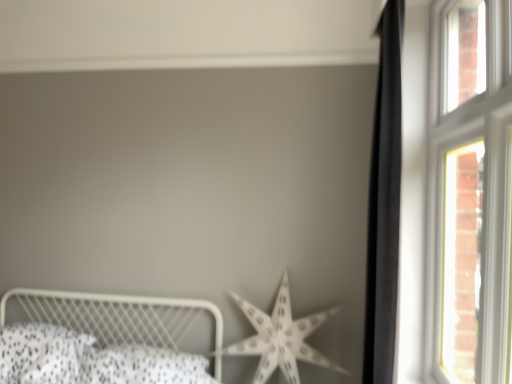
You are a GUI agent. You are given a task and a screenshot of the screen. Output one action in this format:
    pyautogui.click(x=<x>, y=<y>)
    Task: Click on the white wooden window at right
    The image size is (512, 384).
    Given the screenshot: What is the action you would take?
    pyautogui.click(x=469, y=193)

Locate an element on the screen. The height and width of the screenshot is (384, 512). black matte curtain at right is located at coordinates (384, 203).

Locate an element on the screen. white paper star at center is located at coordinates (280, 337).

Where is `white wooden window at right`? white wooden window at right is located at coordinates (469, 193).

At what (x,y) coordinates should I click in order to perform the action: click on curtain below the white wooden window at right (from a real-world perspective). Please return your answer as a coordinate pair (x, y). The image size is (512, 384). Looking at the image, I should click on (384, 203).

Can you tell me how much black matte curtain at right and white wooden window at right differ in facing direction?

There is a 2.27-degree angle between the facing directions of black matte curtain at right and white wooden window at right.

Considering the relative sizes of black matte curtain at right and white wooden window at right in the image provided, is black matte curtain at right smaller than white wooden window at right?

Correct, black matte curtain at right occupies less space than white wooden window at right.

From the image's perspective, is black matte curtain at right located above or below white wooden window at right?

black matte curtain at right is situated lower than white wooden window at right in the image.

Is black matte curtain at right not inside white paper star at center?

Yes, black matte curtain at right is located beyond the bounds of white paper star at center.

Does black matte curtain at right have a greater width compared to white paper star at center?

No, black matte curtain at right is not wider than white paper star at center.

Considering the relative sizes of black matte curtain at right and white paper star at center in the image provided, is black matte curtain at right bigger than white paper star at center?

No, black matte curtain at right is not bigger than white paper star at center.

Is black matte curtain at right aimed at white paper star at center?

No, black matte curtain at right is not turned towards white paper star at center.

From the image's perspective, who appears lower, black matte curtain at right or white metal bed at lower left?

white metal bed at lower left appears lower in the image.

From the picture: Which object is positioned more to the left, black matte curtain at right or white metal bed at lower left?

white metal bed at lower left.

Is black matte curtain at right oriented towards white metal bed at lower left?

Yes, black matte curtain at right faces towards white metal bed at lower left.

Is point (436, 215) behind point (281, 353)?

No, it is in front of (281, 353).

From the image's perspective, is white wooden window at right beneath white paper star at center?

Actually, white wooden window at right appears above white paper star at center in the image.

From a real-world perspective, is white wooden window at right physically located above or below white paper star at center?

In terms of real-world spatial position, white wooden window at right is above white paper star at center.

From the image's perspective, who appears lower, white wooden window at right or black matte curtain at right?

black matte curtain at right, from the image's perspective.

Considering the sizes of objects white wooden window at right and black matte curtain at right in the image provided, who is wider, white wooden window at right or black matte curtain at right?

black matte curtain at right is wider.

Is white wooden window at right turned away from black matte curtain at right?

Yes.

Is point (426, 258) positioned after point (394, 321)?

Yes, point (426, 258) is behind point (394, 321).

Can white metal bed at lower left be found inside white wooden window at right?

No, white metal bed at lower left is not surrounded by white wooden window at right.

Is white wooden window at right bigger than white metal bed at lower left?

No, white wooden window at right is not bigger than white metal bed at lower left.

From the image's perspective, which one is positioned higher, white wooden window at right or white metal bed at lower left?

white wooden window at right appears higher in the image.

Is white wooden window at right wider or thinner than white metal bed at lower left?

Clearly, white wooden window at right has less width compared to white metal bed at lower left.

Considering the positions of objects white paper star at center and black matte curtain at right in the image provided, who is more to the left, white paper star at center or black matte curtain at right?

From the viewer's perspective, white paper star at center appears more on the left side.

From a real-world perspective, is white paper star at center on black matte curtain at right?

Incorrect, from a real-world perspective, white paper star at center is lower than black matte curtain at right.

Is white paper star at center turned away from black matte curtain at right?

No.

Which object is closer to the camera, white paper star at center or black matte curtain at right?

black matte curtain at right is closer to the camera.

Find the location of a particular element. window above the black matte curtain at right (from the image's perspective) is located at coordinates (469, 193).

What are the coordinates of `curtain to the right of white paper star at center` in the screenshot? It's located at (384, 203).

From the image, which object appears to be farther from white metal bed at lower left, white paper star at center or black matte curtain at right?

black matte curtain at right.

When comparing their distances from black matte curtain at right, does white wooden window at right or white metal bed at lower left seem closer?

Based on the image, white wooden window at right appears to be nearer to black matte curtain at right.

Based on the photo, when comparing their distances from white wooden window at right, does black matte curtain at right or white paper star at center seem closer?

black matte curtain at right is closer to white wooden window at right.

When comparing their distances from white paper star at center, does white wooden window at right or black matte curtain at right seem further?

The object further to white paper star at center is white wooden window at right.

Looking at the image, which one is located further to white paper star at center, black matte curtain at right or white metal bed at lower left?

black matte curtain at right is further to white paper star at center.

When comparing their distances from white wooden window at right, does black matte curtain at right or white metal bed at lower left seem closer?

black matte curtain at right is closer to white wooden window at right.

Estimate the real-world distances between objects in this image. Which object is closer to white paper star at center, black matte curtain at right or white wooden window at right?

Among the two, black matte curtain at right is located nearer to white paper star at center.

Based on their spatial positions, is white metal bed at lower left or white wooden window at right closer to black matte curtain at right?

white wooden window at right.

At what (x,y) coordinates should I click in order to perform the action: click on starfish situated between white metal bed at lower left and white wooden window at right from left to right. Please return your answer as a coordinate pair (x, y). Looking at the image, I should click on (280, 337).

I want to click on starfish located between white metal bed at lower left and black matte curtain at right in the left-right direction, so click(x=280, y=337).

Locate an element on the screen. curtain located between white metal bed at lower left and white wooden window at right in the left-right direction is located at coordinates (384, 203).

Locate an element on the screen. curtain located between white wooden window at right and white paper star at center in the depth direction is located at coordinates (384, 203).